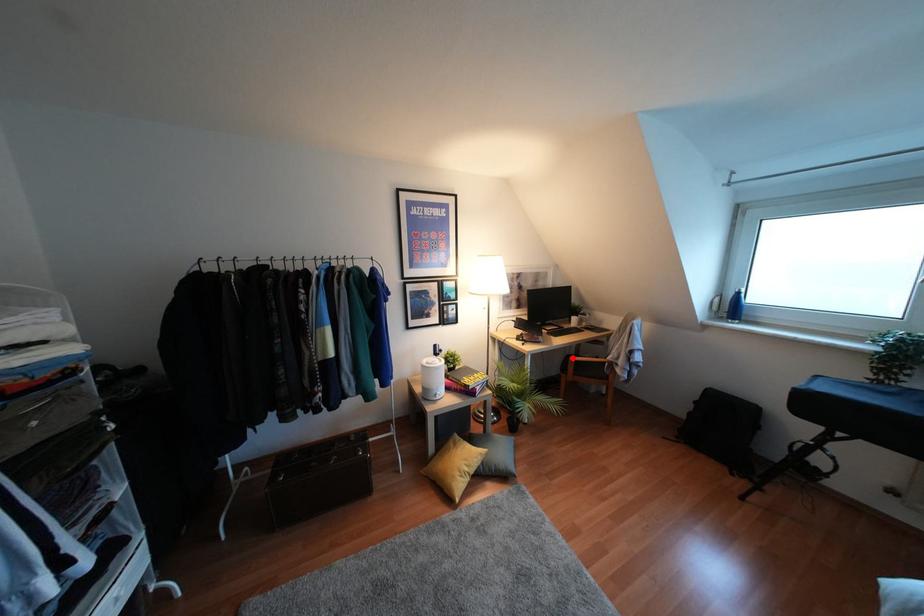
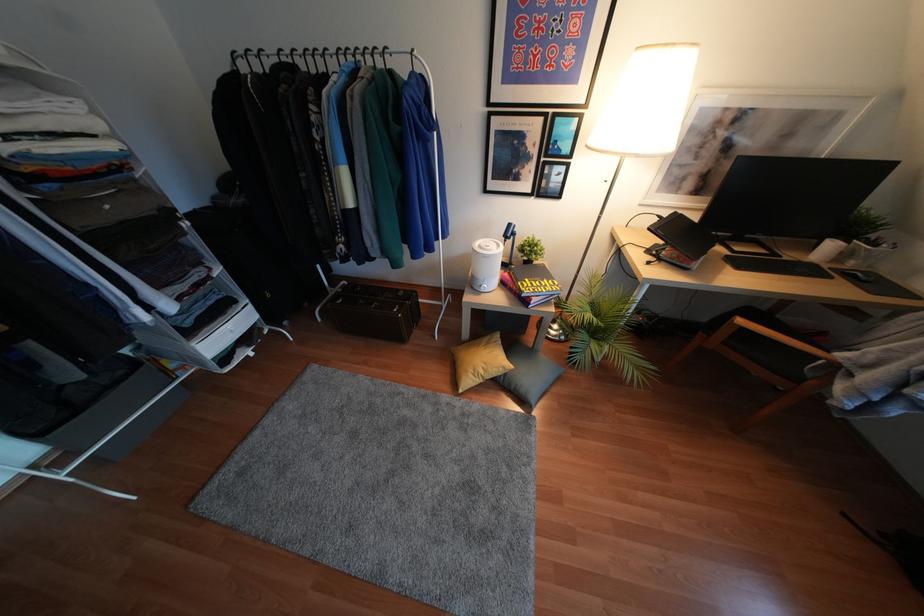
The point at the highlighted location is marked in the first image. Where is the corresponding point in the second image?

(739, 321)